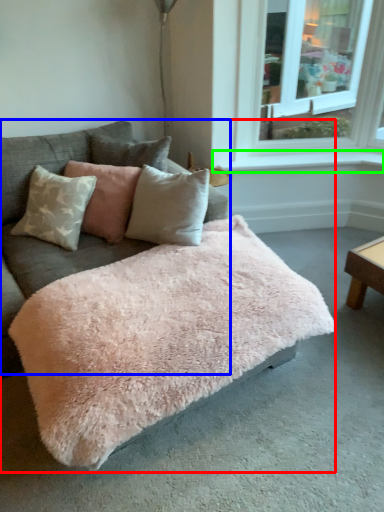
Question: Estimate the real-world distances between objects in this image. Which object is farther from studio couch (highlighted by a red box), couch (highlighted by a blue box) or window sill (highlighted by a green box)?

Choices:
 (A) couch
 (B) window sill

Answer: (B)